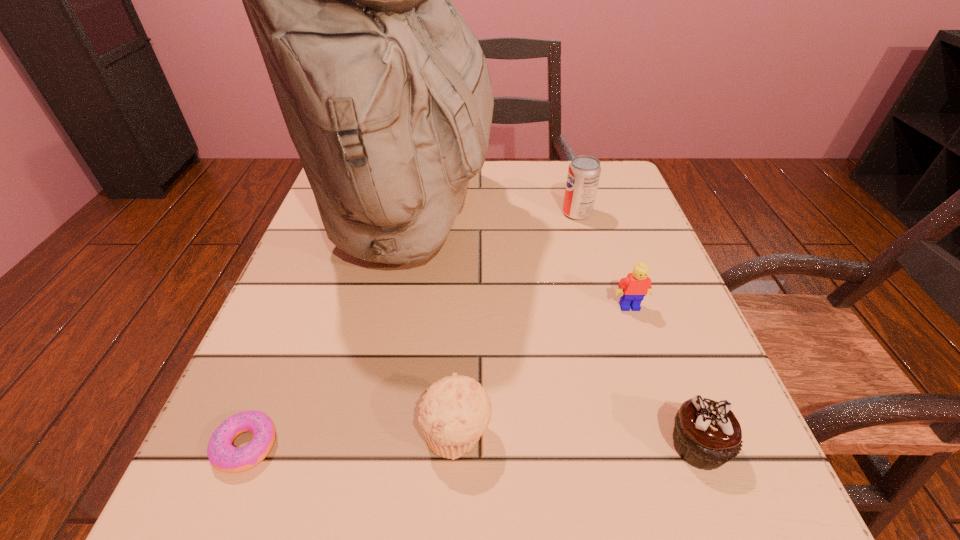
The image size is (960, 540). I want to click on free space at the near right corner, so click(746, 459).

Where is `free spot between the muffin and the Lego`? Image resolution: width=960 pixels, height=540 pixels. free spot between the muffin and the Lego is located at coordinates (543, 370).

This screenshot has height=540, width=960. Identify the location of free space between the cupcake and the Lego. (664, 376).

At what (x,y) coordinates should I click in order to perform the action: click on vacant space in between the Lego and the cupcake. Please return your answer as a coordinate pair (x, y). This screenshot has width=960, height=540. Looking at the image, I should click on (664, 376).

Locate an element on the screen. This screenshot has height=540, width=960. vacant point located between the muffin and the shortest object is located at coordinates (351, 440).

This screenshot has height=540, width=960. Find the location of `vacant area that lies between the muffin and the shortest object`. vacant area that lies between the muffin and the shortest object is located at coordinates (351, 440).

Find the location of a particular element. This screenshot has width=960, height=540. blank region between the backpack and the doughnut is located at coordinates (327, 333).

Locate an element on the screen. This screenshot has height=540, width=960. unoccupied position between the muffin and the Lego is located at coordinates (543, 370).

Locate an element on the screen. Image resolution: width=960 pixels, height=540 pixels. empty location between the tallest object and the doughnut is located at coordinates point(327,333).

I want to click on vacant space in between the Lego and the soda, so click(603, 260).